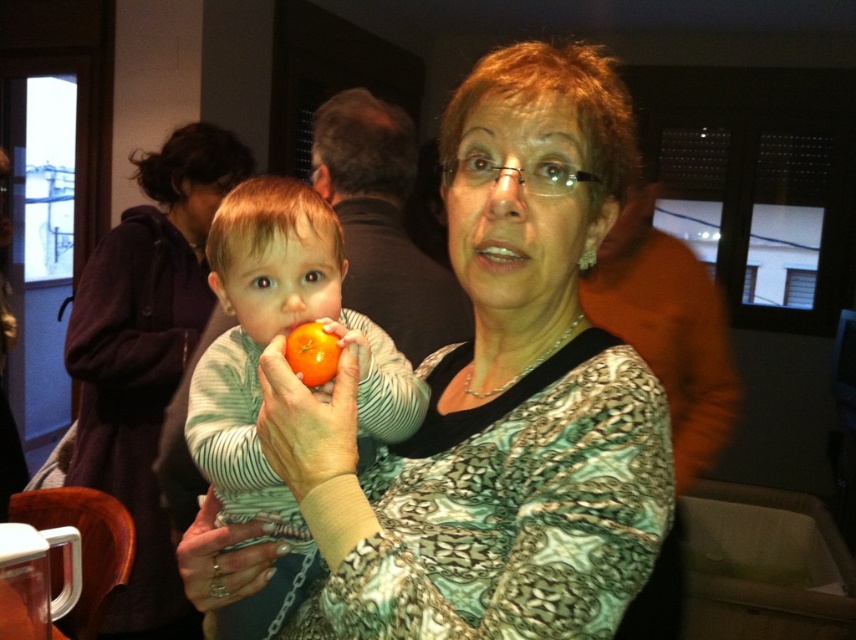
Question: Is matte black sweater at center positioned at the back of matte orange at center?

Choices:
 (A) no
 (B) yes

Answer: (B)

Question: Where is matte green dress at center located in relation to metallic ring at center in the image?

Choices:
 (A) left
 (B) right

Answer: (B)

Question: Which point is farther from the camera taking this photo?

Choices:
 (A) (281, 442)
 (B) (351, 448)

Answer: (A)

Question: Is smooth orange at center closer to camera compared to matte orange at center?

Choices:
 (A) yes
 (B) no

Answer: (B)

Question: Which object appears closest to the camera in this image?

Choices:
 (A) matte orange at center
 (B) metallic ring at center

Answer: (A)

Question: Which object is closer to the camera taking this photo?

Choices:
 (A) matte green dress at center
 (B) metallic ring at center

Answer: (A)